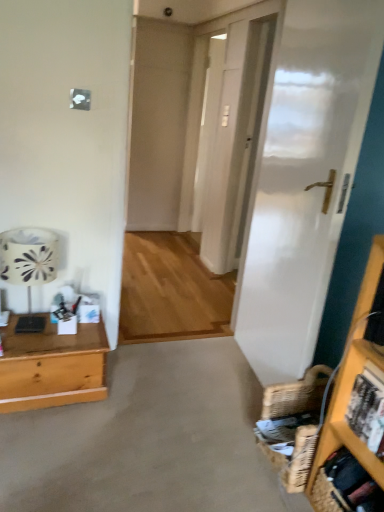
Question: Choose the correct answer: Is white fabric lampshade at left inside wooden desk at left or outside it?

Choices:
 (A) outside
 (B) inside

Answer: (A)

Question: In the image, is white fabric lampshade at left positioned in front of or behind wooden desk at left?

Choices:
 (A) behind
 (B) front

Answer: (B)

Question: Considering the real-world distances, which object is closest to the white fabric lampshade at left?

Choices:
 (A) transparent glass door at center
 (B) beige carpet at lower center
 (C) wooden desk at left
 (D) woven brown basket at lower right

Answer: (C)

Question: Which of these objects is positioned closest to the transparent glass door at center?

Choices:
 (A) wooden desk at left
 (B) beige carpet at lower center
 (C) woven brown basket at lower right
 (D) white fabric lampshade at left

Answer: (D)